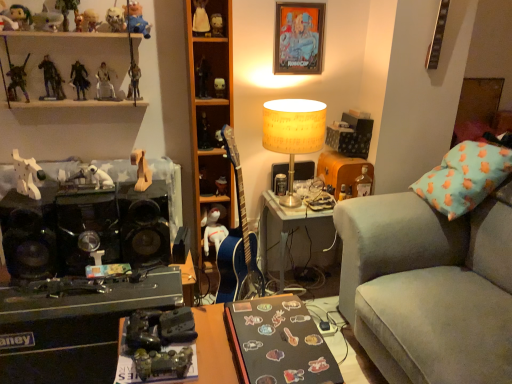
Question: From a real-world perspective, does blue fabric toy at upper left, placed as the 16th toy when sorted from bottom to top, stand above matte plastic action figure at center, which is counted as the thirteenth toy, starting from the top?

Choices:
 (A) no
 (B) yes

Answer: (B)

Question: Is blue fabric toy at upper left, placed as the 16th toy when sorted from bottom to top, placed right next to matte plastic action figure at center, arranged as the 6th toy when ordered from the bottom?

Choices:
 (A) no
 (B) yes

Answer: (A)

Question: Is blue fabric toy at upper left, which appears as the 3th toy when viewed from the top, taller than matte plastic action figure at center, arranged as the 6th toy when ordered from the bottom?

Choices:
 (A) no
 (B) yes

Answer: (B)

Question: Does blue fabric toy at upper left, which appears as the 3th toy when viewed from the top, have a larger size compared to matte plastic action figure at center, which is counted as the thirteenth toy, starting from the top?

Choices:
 (A) no
 (B) yes

Answer: (B)

Question: Does blue fabric toy at upper left, which appears as the 3th toy when viewed from the top, have a greater width compared to matte plastic action figure at center, which is counted as the thirteenth toy, starting from the top?

Choices:
 (A) yes
 (B) no

Answer: (A)

Question: Is wooden horse at center, marked as the 15th toy in a top-to-bottom arrangement, in front of or behind velvet grey couch at right in the image?

Choices:
 (A) front
 (B) behind

Answer: (B)

Question: Considering the positions of wooden horse at center, marked as the 15th toy in a top-to-bottom arrangement, and velvet grey couch at right in the image, is wooden horse at center, marked as the 15th toy in a top-to-bottom arrangement, bigger or smaller than velvet grey couch at right?

Choices:
 (A) big
 (B) small

Answer: (B)

Question: Looking at their shapes, would you say wooden horse at center, arranged as the 4th toy when ordered from the bottom, is wider or thinner than velvet grey couch at right?

Choices:
 (A) thin
 (B) wide

Answer: (A)

Question: From the image's perspective, is wooden horse at center, marked as the 15th toy in a top-to-bottom arrangement, positioned above or below velvet grey couch at right?

Choices:
 (A) above
 (B) below

Answer: (A)

Question: From a real-world perspective, is black matte desk at lower center, the 1th desk from the right, above or below matte plastic toy at upper left, the 13th toy in the bottom-to-top sequence?

Choices:
 (A) below
 (B) above

Answer: (A)

Question: Considering the positions of black matte desk at lower center, the 1th desk from the right, and matte plastic toy at upper left, acting as the 6th toy starting from the top, in the image, is black matte desk at lower center, the 1th desk from the right, bigger or smaller than matte plastic toy at upper left, acting as the 6th toy starting from the top,?

Choices:
 (A) small
 (B) big

Answer: (B)

Question: Considering the relative positions of black matte desk at lower center, the 1th desk from the right, and matte plastic toy at upper left, the 13th toy in the bottom-to-top sequence, in the image provided, is black matte desk at lower center, the 1th desk from the right, to the left or to the right of matte plastic toy at upper left, the 13th toy in the bottom-to-top sequence,?

Choices:
 (A) left
 (B) right

Answer: (B)

Question: Considering the positions of black matte desk at lower center, the 1th desk from the right, and matte plastic toy at upper left, the 13th toy in the bottom-to-top sequence, in the image, is black matte desk at lower center, the 1th desk from the right, taller or shorter than matte plastic toy at upper left, the 13th toy in the bottom-to-top sequence,?

Choices:
 (A) short
 (B) tall

Answer: (A)

Question: From the image's perspective, is metallic silver figure at upper left, which ranks as the 11th toy in top-to-bottom order, above or below translucent glass bottle at right?

Choices:
 (A) above
 (B) below

Answer: (A)

Question: From a real-world perspective, is metallic silver figure at upper left, which ranks as the 11th toy in top-to-bottom order, above or below translucent glass bottle at right?

Choices:
 (A) above
 (B) below

Answer: (A)